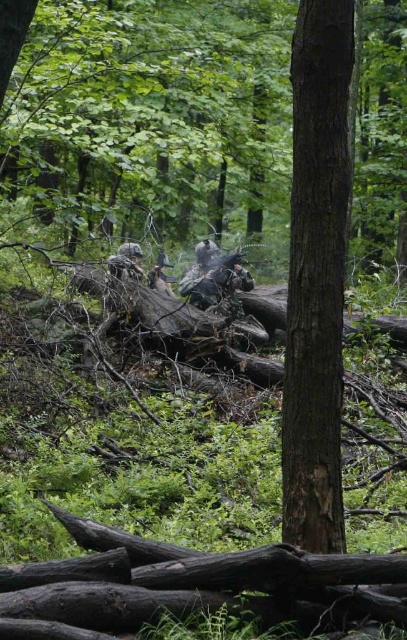
Describe the element at coordinates (317, 276) in the screenshot. This screenshot has height=640, width=407. I see `brown rough tree trunk at center` at that location.

Can you confirm if brown rough tree trunk at center is positioned to the right of camouflage uniform at center?

Yes, brown rough tree trunk at center is to the right of camouflage uniform at center.

Based on the photo, who is more distant from viewer, (308, 492) or (115, 259)?

Point (115, 259)

This screenshot has height=640, width=407. Find the location of `brown rough tree trunk at center`. brown rough tree trunk at center is located at coordinates (317, 276).

Measure the distance between point (234, 564) and camera.

Point (234, 564) and camera are 4.15 meters apart from each other.

Between point (367, 557) and point (131, 243), which one is positioned behind?

Point (131, 243)

Measure the distance between point (395, 611) and camera.

Point (395, 611) and camera are 4.16 meters apart from each other.

Find the location of a particular element. The image size is (407, 640). dark brown wood log at center is located at coordinates (196, 582).

Measure the distance from brown rough tree trunk at center to dark brown wood log at center.

brown rough tree trunk at center is 32.65 inches away from dark brown wood log at center.

Is the position of brown rough tree trunk at center more distant than that of dark brown wood log at center?

That is True.

Does point (323, 22) lie behind point (98, 621)?

That is True.

At what (x,y) coordinates should I click in order to perform the action: click on brown rough tree trunk at center. Please return your answer as a coordinate pair (x, y). The width and height of the screenshot is (407, 640). Looking at the image, I should click on (317, 276).